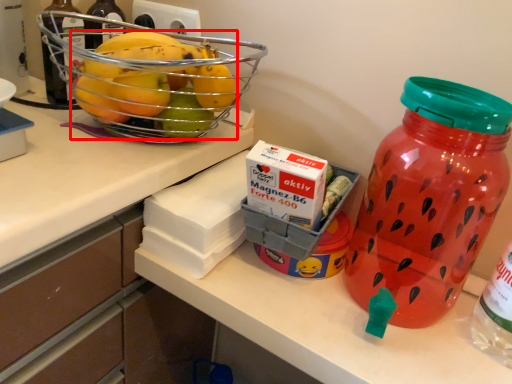
Question: From the image's perspective, what is the correct spatial relationship of grapefruit (annotated by the red box) in relation to bottle?

Choices:
 (A) below
 (B) above

Answer: (B)